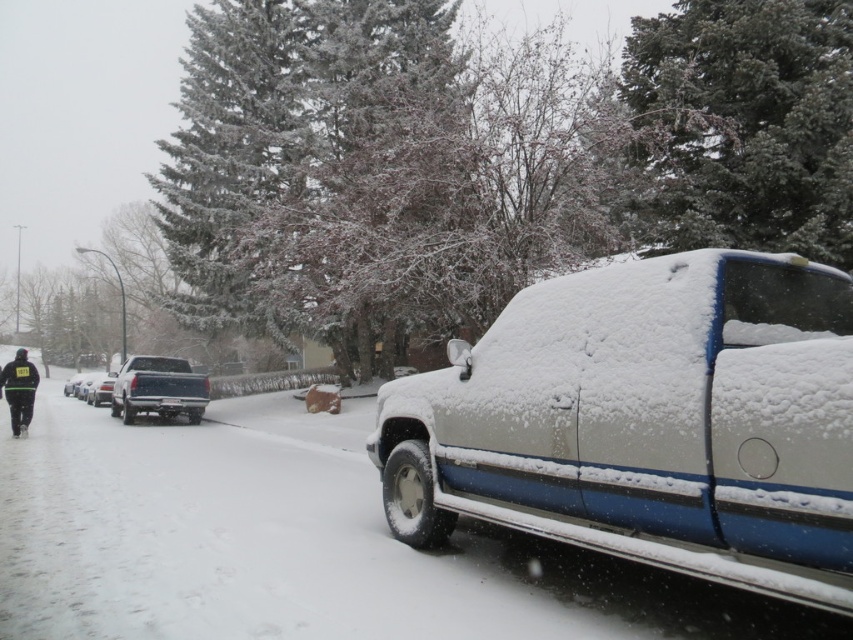
Can you confirm if white matte truck at center is bigger than matte black truck at center?

Incorrect, white matte truck at center is not larger than matte black truck at center.

Identify the location of white matte truck at center. (647, 422).

At what (x,y) coordinates should I click in order to perform the action: click on matte black truck at center. Please return your answer as a coordinate pair (x, y). Looking at the image, I should click on (158, 388).

Between matte black truck at center and silver metallic truck at center, which one appears on the left side from the viewer's perspective?

From the viewer's perspective, silver metallic truck at center appears more on the left side.

I want to click on matte black truck at center, so click(x=158, y=388).

Locate an element on the screen. Image resolution: width=853 pixels, height=640 pixels. matte black truck at center is located at coordinates (158, 388).

Between matte black truck at center and black fabric jacket at lower left, which one appears on the right side from the viewer's perspective?

matte black truck at center

Is the position of matte black truck at center more distant than that of black fabric jacket at lower left?

Yes, matte black truck at center is further from the viewer.

Which is in front, point (131, 362) or point (16, 392)?

Point (16, 392) is in front.

This screenshot has height=640, width=853. In order to click on matte black truck at center in this screenshot , I will do `click(158, 388)`.